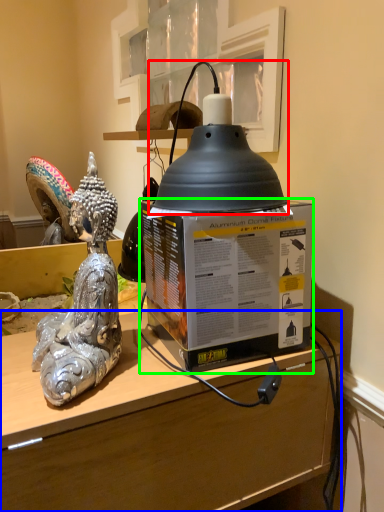
Question: Estimate the real-world distances between objects in this image. Which object is closer to oil lamp (highlighted by a red box), desk (highlighted by a blue box) or box (highlighted by a green box)?

Choices:
 (A) desk
 (B) box

Answer: (B)